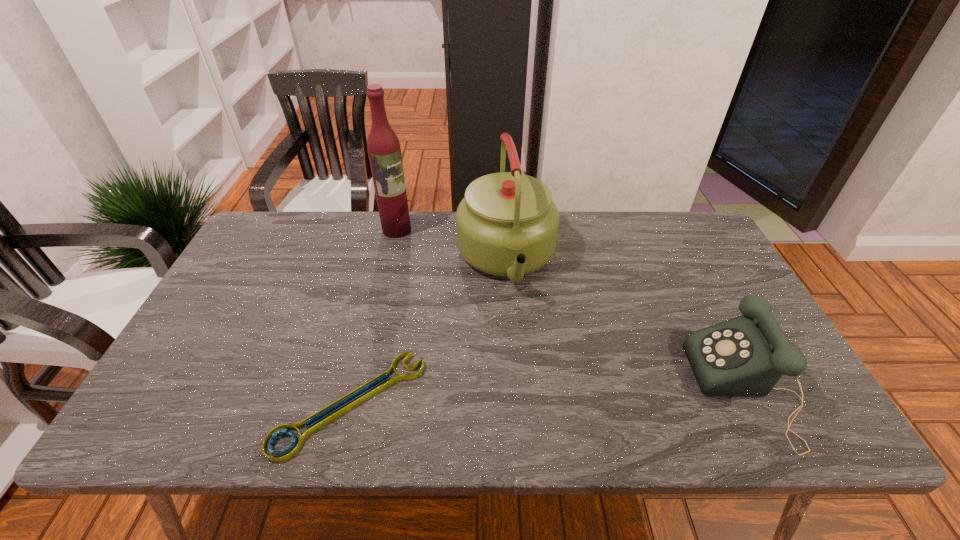
Where is `object located at the right edge`? object located at the right edge is located at coordinates (747, 355).

Find the location of a particular element. The image size is (960, 540). object that is positioned at the near right corner is located at coordinates (747, 355).

Image resolution: width=960 pixels, height=540 pixels. Find the location of `vacant area at the far edge`. vacant area at the far edge is located at coordinates (653, 250).

Where is `vacant space at the near edge`? vacant space at the near edge is located at coordinates (596, 376).

The height and width of the screenshot is (540, 960). I want to click on vacant area at the left edge of the desktop, so click(280, 283).

This screenshot has height=540, width=960. In order to click on free location at the right edge of the desktop in this screenshot , I will do `click(717, 309)`.

Where is `free location at the far right corner of the desktop`? This screenshot has height=540, width=960. free location at the far right corner of the desktop is located at coordinates (657, 215).

I want to click on empty space between the tallest object and the telephone, so click(x=571, y=309).

In order to click on free spot between the tallest object and the rightmost object in this screenshot , I will do `click(571, 309)`.

You are a GUI agent. You are given a task and a screenshot of the screen. Output one action in this format:
    pyautogui.click(x=<x>, y=<y>)
    Task: Click on the vacant space that's between the shortest object and the second object from right to left
    The width and height of the screenshot is (960, 540).
    Given the screenshot: What is the action you would take?
    pyautogui.click(x=428, y=332)